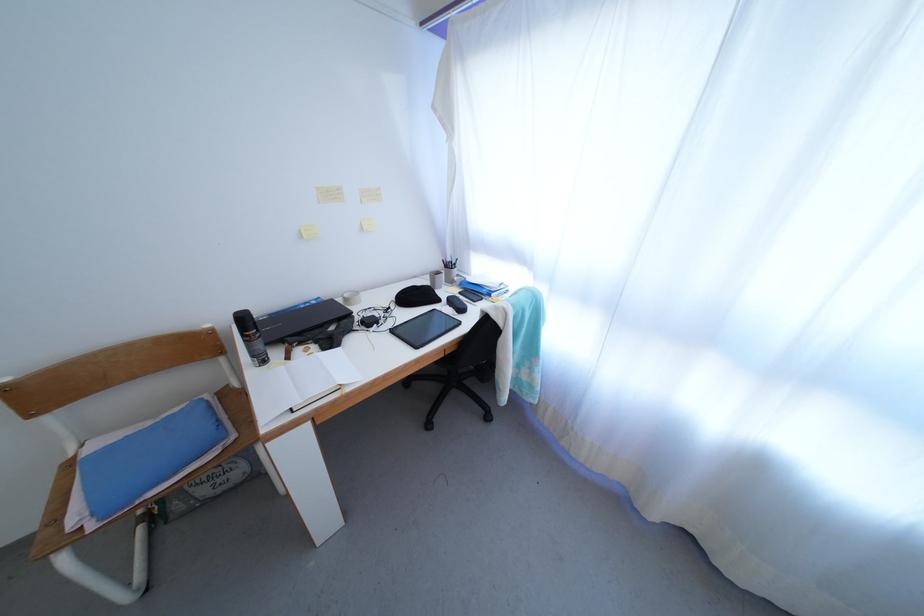
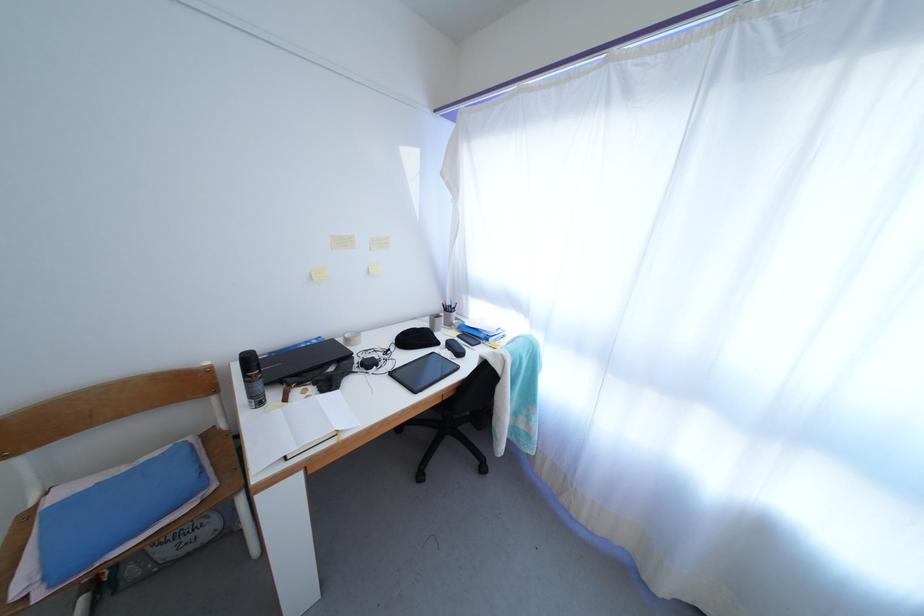
Where in the second image is the point corresponding to [456,307] from the first image?

(456, 351)